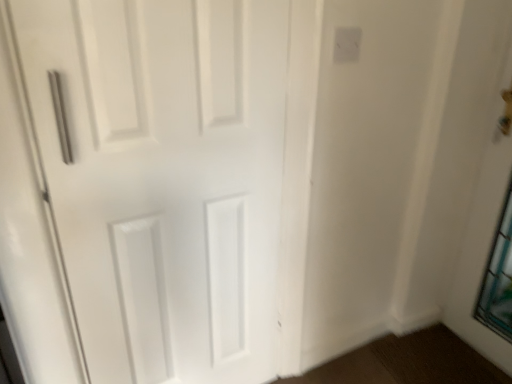
Question: From the image's perspective, is white matte door at left positioned above or below white plastic electric outlet at upper right?

Choices:
 (A) above
 (B) below

Answer: (B)

Question: In the image, is white matte door at left positioned in front of or behind white plastic electric outlet at upper right?

Choices:
 (A) behind
 (B) front

Answer: (B)

Question: Is white matte door at left bigger or smaller than white plastic electric outlet at upper right?

Choices:
 (A) big
 (B) small

Answer: (A)

Question: Looking at their shapes, would you say white plastic electric outlet at upper right is wider or thinner than white matte door at left?

Choices:
 (A) wide
 (B) thin

Answer: (B)

Question: From a real-world perspective, relative to white matte door at left, is white plastic electric outlet at upper right vertically above or below?

Choices:
 (A) below
 (B) above

Answer: (B)

Question: Would you say white plastic electric outlet at upper right is inside or outside white matte door at left?

Choices:
 (A) outside
 (B) inside

Answer: (A)

Question: Is white plastic electric outlet at upper right to the left or to the right of white matte door at left in the image?

Choices:
 (A) left
 (B) right

Answer: (B)